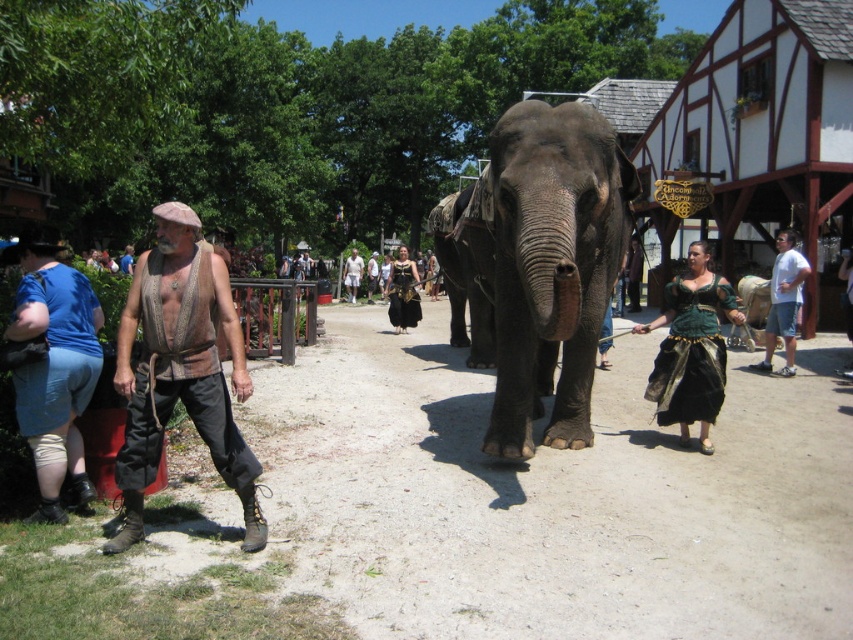
Can you confirm if blue denim shorts at lower left is smaller than black velvet dress at center?

Yes, blue denim shorts at lower left is smaller than black velvet dress at center.

Is blue denim shorts at lower left to the left of black velvet dress at center from the viewer's perspective?

Correct, you'll find blue denim shorts at lower left to the left of black velvet dress at center.

Where is `blue denim shorts at lower left`? blue denim shorts at lower left is located at coordinates (54, 365).

Based on the photo, is dark gray textured elephant at center taller than white cotton shirt at center?

Yes.

Can you confirm if dark gray textured elephant at center is thinner than white cotton shirt at center?

No.

Where is `dark gray textured elephant at center`? The image size is (853, 640). dark gray textured elephant at center is located at coordinates coord(544,262).

Find the location of a particular element. dark gray textured elephant at center is located at coordinates (544, 262).

Is brown woven vest at left to the right of blue denim shorts at lower left from the viewer's perspective?

Indeed, brown woven vest at left is positioned on the right side of blue denim shorts at lower left.

Measure the distance from brown woven vest at left to blue denim shorts at lower left.

brown woven vest at left and blue denim shorts at lower left are 32.13 inches apart.

The image size is (853, 640). I want to click on brown woven vest at left, so click(180, 369).